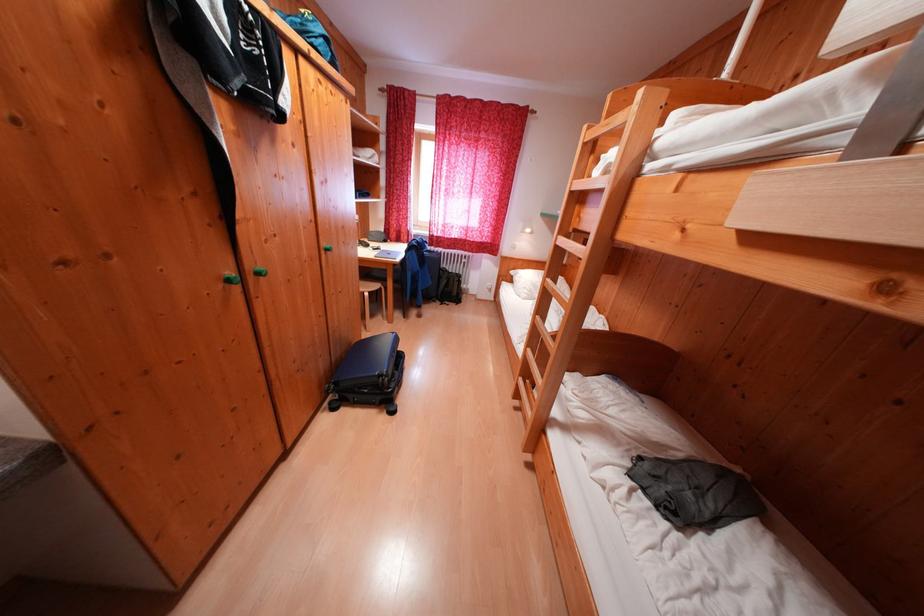
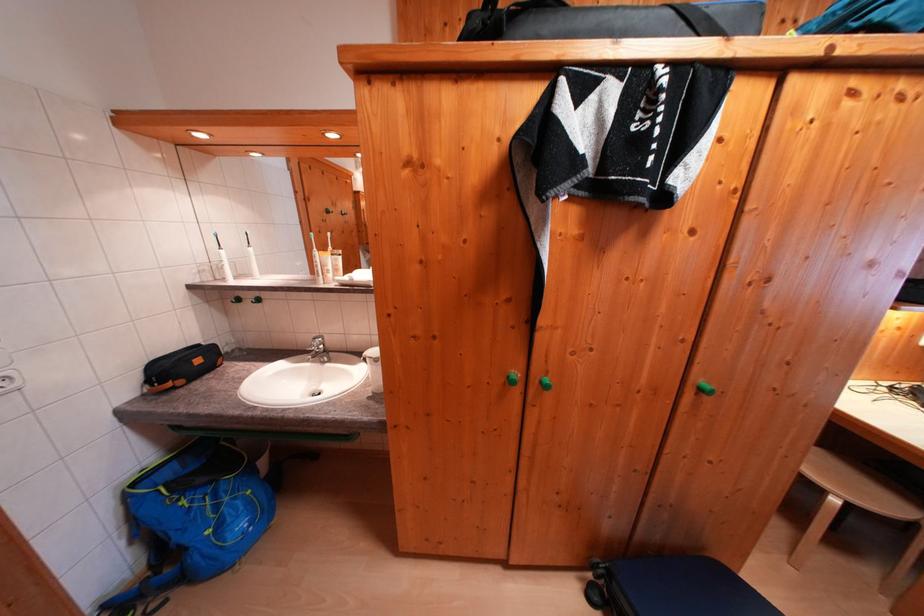
The point at (x=229, y=290) is marked in the first image. Where is the corresponding point in the second image?

(511, 384)